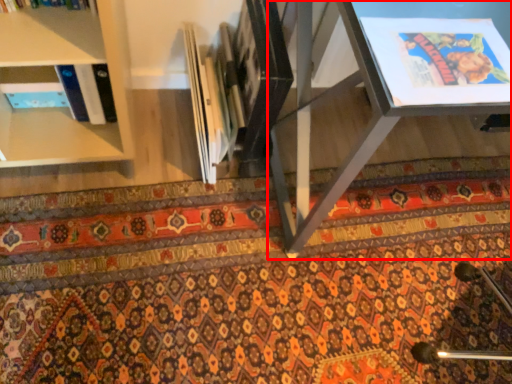
Question: Considering the relative positions of table (annotated by the red box) and mat in the image provided, where is table (annotated by the red box) located with respect to the staircase?

Choices:
 (A) left
 (B) right

Answer: (B)